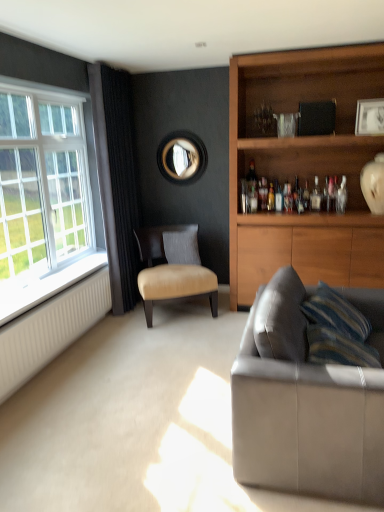
Question: From their relative heights in the image, would you say white painted wood at left is taller or shorter than translucent glass bottle at shelf center, acting as the 2th bottle starting from the front?

Choices:
 (A) tall
 (B) short

Answer: (B)

Question: Looking at their shapes, would you say white painted wood at left is wider or thinner than translucent glass bottle at shelf center, the second bottle from the right?

Choices:
 (A) wide
 (B) thin

Answer: (A)

Question: Based on their relative distances, which object is farther from the suede gray pillow at center?

Choices:
 (A) clear glass bottle at upper right, which is the 1th bottle from front to back
 (B) translucent glass bottle at shelf center, which is the 1th bottle in left-to-right order
 (C) black velvet curtain at left
 (D) leather at center
 (E) matte black circular mirror at upper center

Answer: (A)

Question: Estimate the real-world distances between objects in this image. Which object is closer to the leather at center?

Choices:
 (A) suede gray pillow at center
 (B) leather couch at lower right
 (C) black velvet curtain at left
 (D) white ribbed radiator at lower left
 (E) translucent glass bottle at shelf center, the first bottle positioned from the back

Answer: (A)